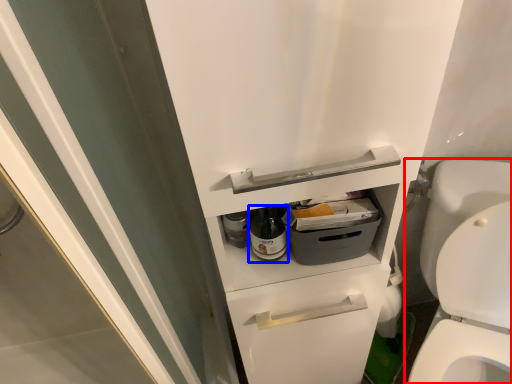
Question: Which point is further to the camera, toilet (highlighted by a red box) or bottle (highlighted by a blue box)?

Choices:
 (A) toilet
 (B) bottle

Answer: (B)